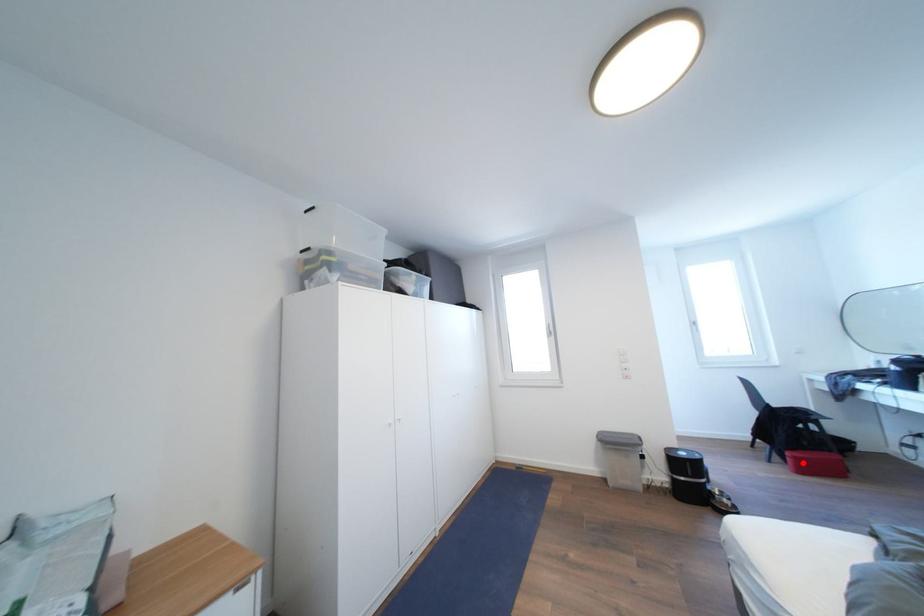
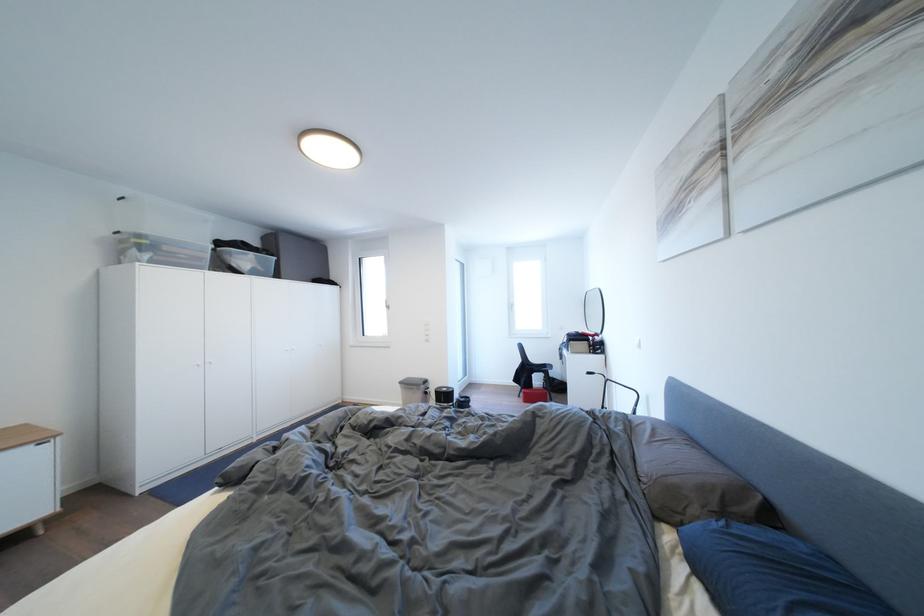
Question: I am providing you with two images of the same scene from different viewpoints. Given a red point in image1, look at the same physical point in image2. Is it:

Choices:
 (A) Closer to the viewpoint
 (B) Farther from the viewpoint

Answer: (B)